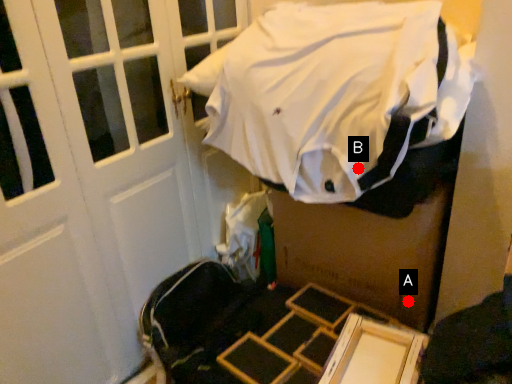
Question: Two points are circled on the image, labeled by A and B beside each circle. Which point is closer to the camera?

Choices:
 (A) A is closer
 (B) B is closer

Answer: (B)